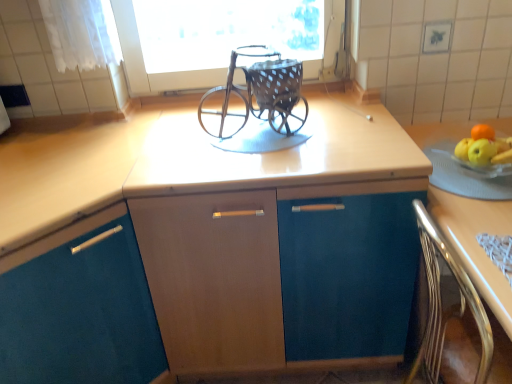
Question: From the image's perspective, relative to rustic metal baby carriage at center, is metallic polished chair at lower right above or below?

Choices:
 (A) above
 (B) below

Answer: (B)

Question: Does point (489, 334) appear closer or farther from the camera than point (230, 135)?

Choices:
 (A) farther
 (B) closer

Answer: (B)

Question: Which is farther from the rustic metal baby carriage at center?

Choices:
 (A) light brown wood at right
 (B) matte wood cabinet at center, the second cabinetry viewed from the left
 (C) metallic polished chair at lower right
 (D) teal matte cabinet at center, arranged as the 1th cabinetry when viewed from the left

Answer: (D)

Question: Which object is the closest to the metallic polished chair at lower right?

Choices:
 (A) matte wood cabinet at center, acting as the first cabinetry starting from the right
 (B) light brown wood at right
 (C) rustic metal baby carriage at center
 (D) teal matte cabinet at center, arranged as the 1th cabinetry when viewed from the left

Answer: (B)